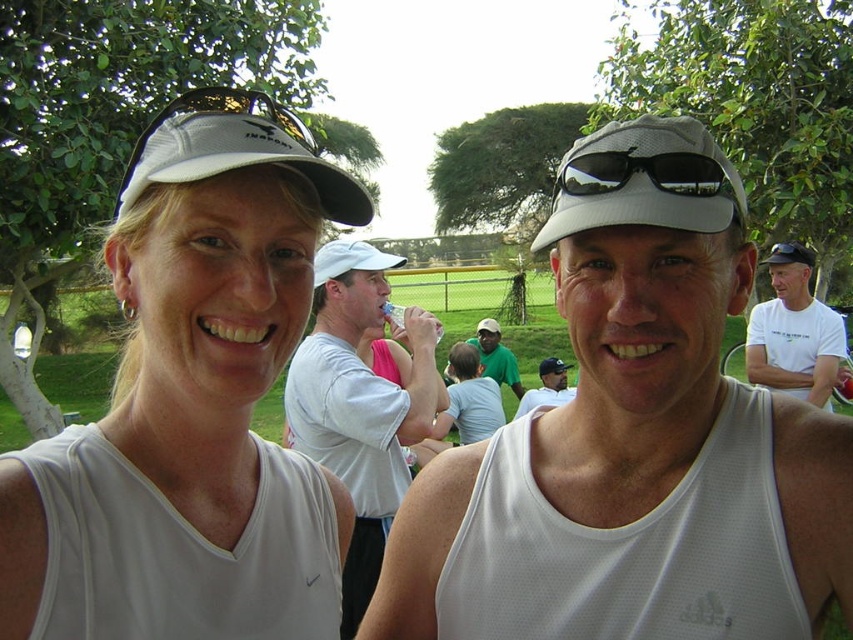
Question: Based on their relative distances, which object is nearer to the white matte cap at upper left?

Choices:
 (A) white mesh baseball cap at center
 (B) white cotton shirt at upper right
 (C) matte white tank top at center
 (D) white mesh cap at upper center

Answer: (D)

Question: Is the position of white mesh tank top at center less distant than that of white matte cap at upper left?

Choices:
 (A) yes
 (B) no

Answer: (B)

Question: Which point appears farthest from the camera in this image?

Choices:
 (A) (262, 116)
 (B) (405, 442)
 (C) (167, 352)
 (D) (573, 394)

Answer: (D)

Question: Does black reflective sunglasses at center have a greater width compared to green mesh shirt at center?

Choices:
 (A) no
 (B) yes

Answer: (A)

Question: Considering the relative positions of white cotton shirt at upper right and white mesh cap at upper center in the image provided, where is white cotton shirt at upper right located with respect to white mesh cap at upper center?

Choices:
 (A) above
 (B) below

Answer: (B)

Question: Which point appears farthest from the camera in this image?

Choices:
 (A) (355, 182)
 (B) (795, 280)
 (C) (666, 596)

Answer: (B)